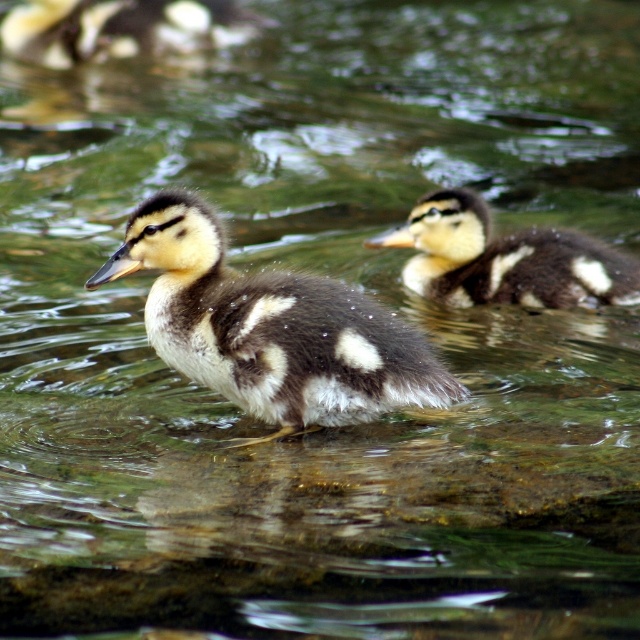
Is soft brown duckling at center smaller than soft brown duckling at upper left?

Yes.

Is point (561, 307) behind point (108, 1)?

No.

You are a GUI agent. You are given a task and a screenshot of the screen. Output one action in this format:
    pyautogui.click(x=<x>, y=<y>)
    Task: Click on the soft brown duckling at center
    
    Given the screenshot: What is the action you would take?
    pyautogui.click(x=504, y=259)

Is point (225, 236) farther from viewer compared to point (566, 241)?

No, (225, 236) is in front of (566, 241).

Is brown speckled duckling at center positioned behind soft brown duckling at center?

No, it is not.

Where is `brown speckled duckling at center`? brown speckled duckling at center is located at coordinates click(x=269, y=328).

Image resolution: width=640 pixels, height=640 pixels. I want to click on brown speckled duckling at center, so click(269, 328).

Does brown speckled duckling at center have a larger size compared to soft brown duckling at upper left?

No.

Who is more forward, (225, 276) or (29, 24)?

Point (225, 276) is more forward.

You are a GUI agent. You are given a task and a screenshot of the screen. Output one action in this format:
    pyautogui.click(x=<x>, y=<y>)
    Task: Click on the brown speckled duckling at center
    
    Given the screenshot: What is the action you would take?
    pyautogui.click(x=269, y=328)